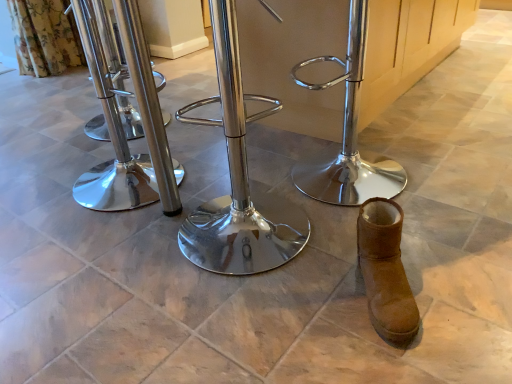
Identify the location of vacant space behind polished metal swivel chair at center, positioned as the 1th swivel chair in right-to-left order. This screenshot has height=384, width=512. (332, 139).